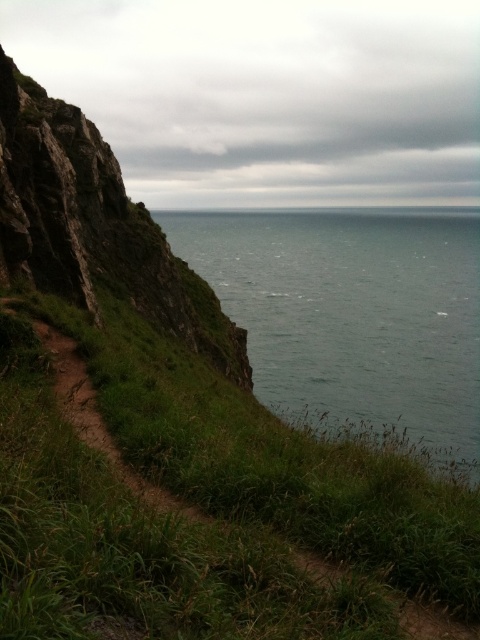
You are standing at the cliff edge and see the point marked at coordinates point (204, 502). What type of terrain feature is located at that point?

The point (204, 502) is where the green grassy at lower left is located.

You are standing at the base of the cliff in the coastal scene. There are two points marked on the ground ahead of you. The first point is at coordinate point(50, 490) and the second is at point(12, 152). If you want to reach the point that is closer to you, which coordinate should you head towards?

You should head towards point(12, 152) because it is closer to your current position at the base of the cliff compared to point(50, 490).